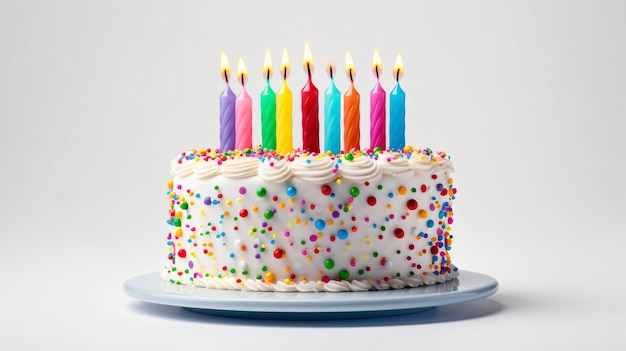
Find the location of `lit birthday candles side by side on a cake`. lit birthday candles side by side on a cake is located at coordinates 227,119, 242,120, 269,120, 282,123, 309,113, 336,116, 351,117, 377,114, 398,116.